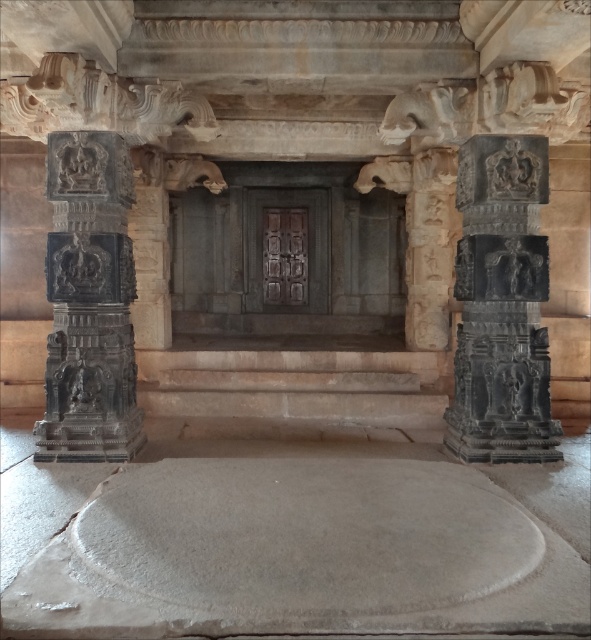
Is dark gray stone column at right bigger than black stone statue at left?

Indeed, dark gray stone column at right has a larger size compared to black stone statue at left.

Looking at this image, does dark gray stone column at right come in front of black stone statue at left?

No.

Which is behind, point (495, 209) or point (73, 372)?

Positioned behind is point (73, 372).

At what (x,y) coordinates should I click in order to perform the action: click on dark gray stone column at right. Please return your answer as a coordinate pair (x, y). Looking at the image, I should click on (501, 305).